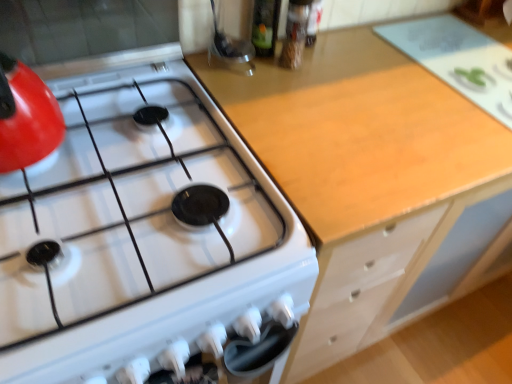
Question: Considering their positions, is light wood cabinet at center located in front of or behind white glossy gas stove at upper left?

Choices:
 (A) behind
 (B) front

Answer: (A)

Question: From their relative heights in the image, would you say light wood cabinet at center is taller or shorter than white glossy gas stove at upper left?

Choices:
 (A) short
 (B) tall

Answer: (B)

Question: Does point (454, 261) appear closer or farther from the camera than point (298, 278)?

Choices:
 (A) farther
 (B) closer

Answer: (A)

Question: Looking at the image, does white glossy gas stove at upper left seem bigger or smaller compared to light wood cabinet at center?

Choices:
 (A) big
 (B) small

Answer: (B)

Question: Choose the correct answer: Is white glossy gas stove at upper left inside light wood cabinet at center or outside it?

Choices:
 (A) outside
 (B) inside

Answer: (A)

Question: Is white glossy gas stove at upper left to the left or to the right of light wood cabinet at center in the image?

Choices:
 (A) left
 (B) right

Answer: (A)

Question: From the image's perspective, is white glossy gas stove at upper left above or below light wood cabinet at center?

Choices:
 (A) below
 (B) above

Answer: (B)